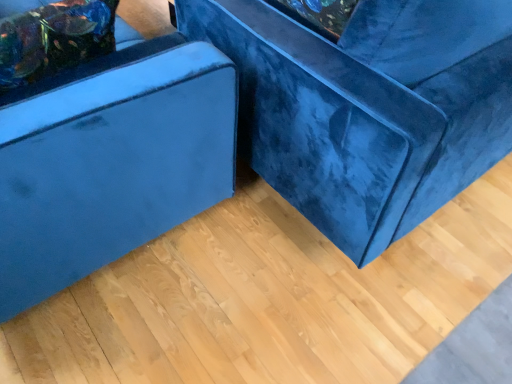
Question: Is velvet blue couch at center, which ranks as the 1th furniture in right-to-left order, not within velvet blue pillow at upper left?

Choices:
 (A) no
 (B) yes

Answer: (B)

Question: Considering the relative sizes of velvet blue couch at center, the second furniture in the left-to-right sequence, and velvet blue pillow at upper left in the image provided, is velvet blue couch at center, the second furniture in the left-to-right sequence, taller than velvet blue pillow at upper left?

Choices:
 (A) no
 (B) yes

Answer: (B)

Question: Can you see velvet blue couch at center, the second furniture in the left-to-right sequence, touching velvet blue pillow at upper left?

Choices:
 (A) no
 (B) yes

Answer: (A)

Question: Considering the relative positions of velvet blue couch at center, the second furniture in the left-to-right sequence, and velvet blue pillow at upper left in the image provided, is velvet blue couch at center, the second furniture in the left-to-right sequence, behind velvet blue pillow at upper left?

Choices:
 (A) yes
 (B) no

Answer: (B)

Question: Is velvet blue couch at center, the second furniture in the left-to-right sequence, in front of velvet blue pillow at upper left?

Choices:
 (A) yes
 (B) no

Answer: (A)

Question: From a real-world perspective, is velvet blue couch at center, which ranks as the 1th furniture in right-to-left order, located beneath velvet blue pillow at upper left?

Choices:
 (A) no
 (B) yes

Answer: (B)

Question: Is velvet blue couch at center, the second furniture in the left-to-right sequence, taller than velvet blue ottoman at left, which ranks as the 1th furniture in left-to-right order?

Choices:
 (A) yes
 (B) no

Answer: (A)

Question: Does velvet blue couch at center, which ranks as the 1th furniture in right-to-left order, have a lesser height compared to velvet blue ottoman at left, which ranks as the 1th furniture in left-to-right order?

Choices:
 (A) no
 (B) yes

Answer: (A)

Question: From a real-world perspective, is velvet blue couch at center, which ranks as the 1th furniture in right-to-left order, on velvet blue ottoman at left, the second furniture in the right-to-left sequence?

Choices:
 (A) yes
 (B) no

Answer: (A)

Question: From a real-world perspective, is velvet blue couch at center, which ranks as the 1th furniture in right-to-left order, beneath velvet blue ottoman at left, the second furniture in the right-to-left sequence?

Choices:
 (A) no
 (B) yes

Answer: (A)

Question: Is velvet blue couch at center, which ranks as the 1th furniture in right-to-left order, behind velvet blue ottoman at left, the second furniture in the right-to-left sequence?

Choices:
 (A) no
 (B) yes

Answer: (B)

Question: Would you consider velvet blue couch at center, the second furniture in the left-to-right sequence, to be distant from velvet blue ottoman at left, the second furniture in the right-to-left sequence?

Choices:
 (A) no
 (B) yes

Answer: (A)

Question: Considering the relative sizes of velvet blue pillow at upper left and velvet blue ottoman at left, which ranks as the 1th furniture in left-to-right order, in the image provided, is velvet blue pillow at upper left bigger than velvet blue ottoman at left, which ranks as the 1th furniture in left-to-right order,?

Choices:
 (A) no
 (B) yes

Answer: (A)